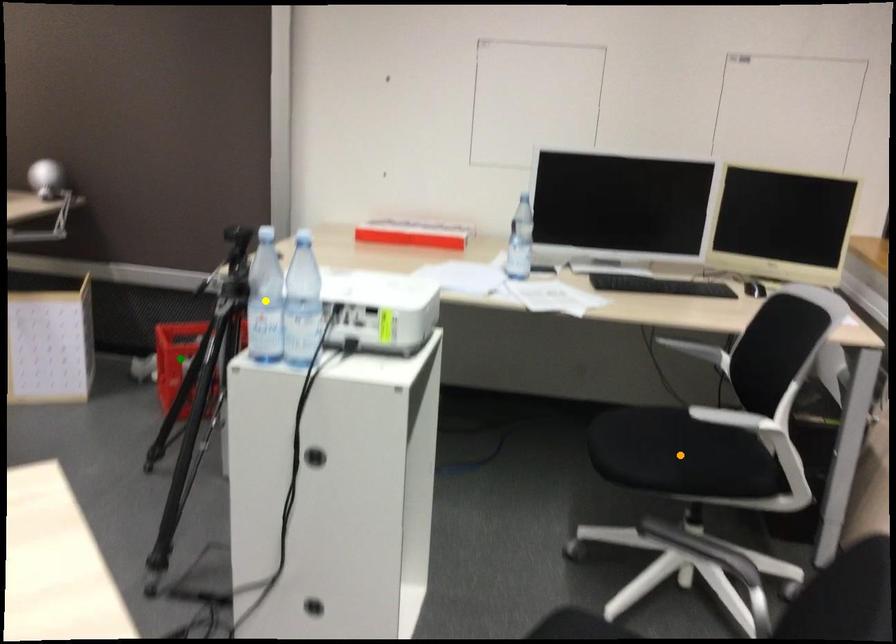
Order these from nearest to farthest:
- yellow point
- green point
- orange point

yellow point → orange point → green point